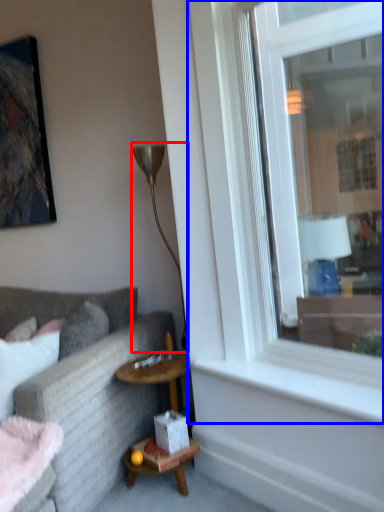
Question: Which of the following is the farthest to the observer, lamp (highlighted by a red box) or window (highlighted by a blue box)?

Choices:
 (A) lamp
 (B) window

Answer: (A)